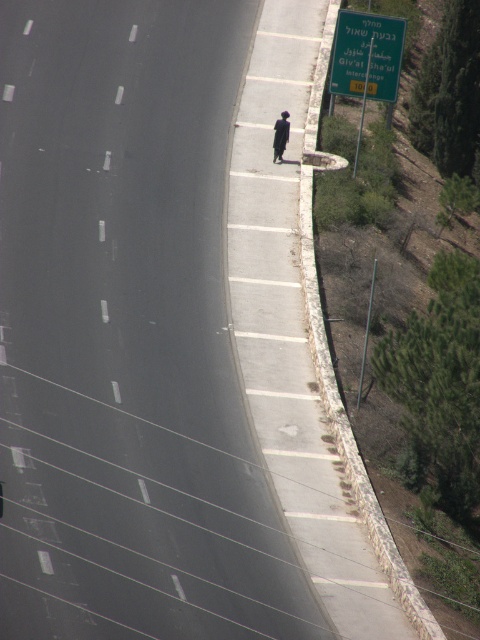
You are a delivery drone flying over the road and need to land on the dirt path at right. However, there is a dark fabric person at right nearby. Based on the scene, can you safely land there without hitting the person?

The dirt path at right is positioned under dark fabric person at right, meaning the person is standing directly above the path. To safely land, the drone should avoid the area directly beneath the person to prevent collision.

You are a delivery drone flying over the road and need to land on the dirt path at right. Based on the coordinates provided in the scene description, where should you aim to land?

The dirt path at right is located at coordinates point (303,336), so you should aim to land there.